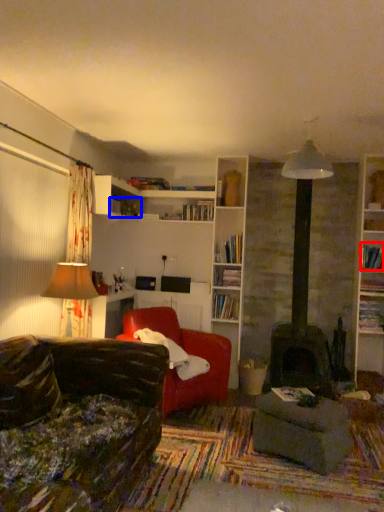
Question: Which object is closer to the camera taking this photo, book (highlighted by a red box) or book (highlighted by a blue box)?

Choices:
 (A) book
 (B) book

Answer: (A)